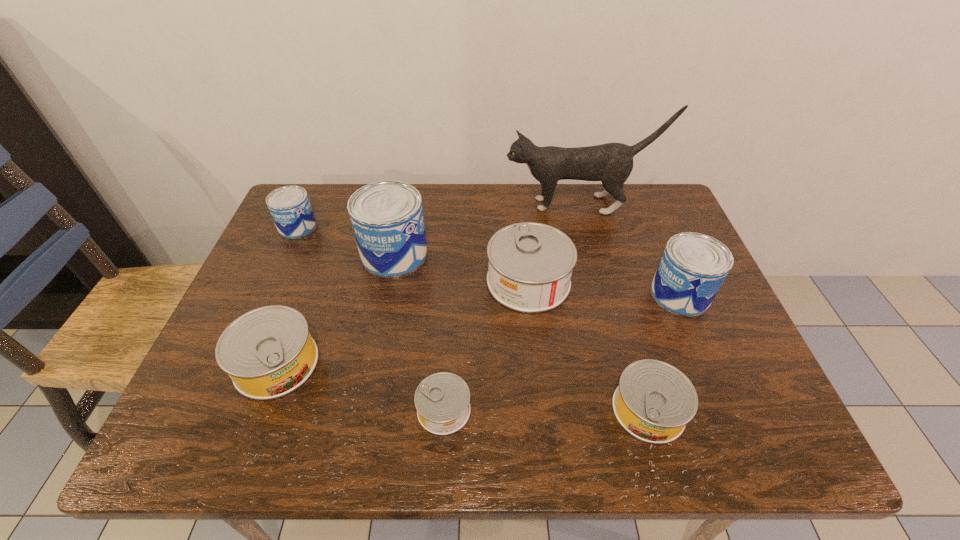
Image resolution: width=960 pixels, height=540 pixels. Identify the location of the third biggest silver can. (654, 401).

Find the location of a particular element. This screenshot has height=540, width=960. the third silver can from right to left is located at coordinates (442, 400).

Where is `the shortest object`? Image resolution: width=960 pixels, height=540 pixels. the shortest object is located at coordinates (442, 400).

The image size is (960, 540). Identify the location of free space located 0.290m at the face of the cat. (410, 205).

The height and width of the screenshot is (540, 960). Identify the location of vacant region located 0.140m at the face of the cat. (459, 205).

At what (x,y) coordinates should I click in order to perform the action: click on vacant space positioned 0.170m at the face of the cat. Please return your answer as a coordinate pair (x, y). The width and height of the screenshot is (960, 540). Looking at the image, I should click on (449, 205).

Identify the location of vacant space situated 0.370m on the front label of the seventh shortest object. (564, 254).

Where is `vacant space located on the front label of the rightmost blue can`? This screenshot has width=960, height=540. vacant space located on the front label of the rightmost blue can is located at coordinates (527, 294).

Image resolution: width=960 pixels, height=540 pixels. In order to click on free space located 0.330m on the front label of the rightmost blue can in this screenshot , I will do `click(518, 294)`.

The width and height of the screenshot is (960, 540). Identify the location of vacant area located 0.300m on the front label of the rightmost blue can. (531, 294).